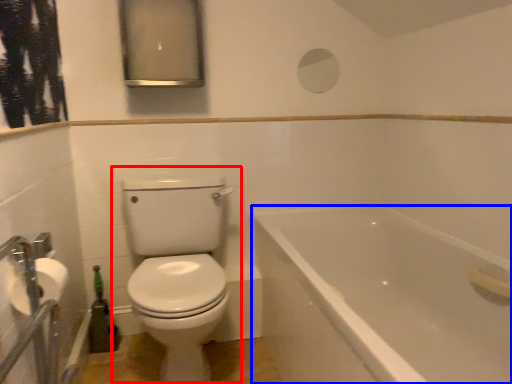
Question: Among these objects, which one is farthest to the camera, toilet (highlighted by a red box) or bathtub (highlighted by a blue box)?

Choices:
 (A) toilet
 (B) bathtub

Answer: (A)